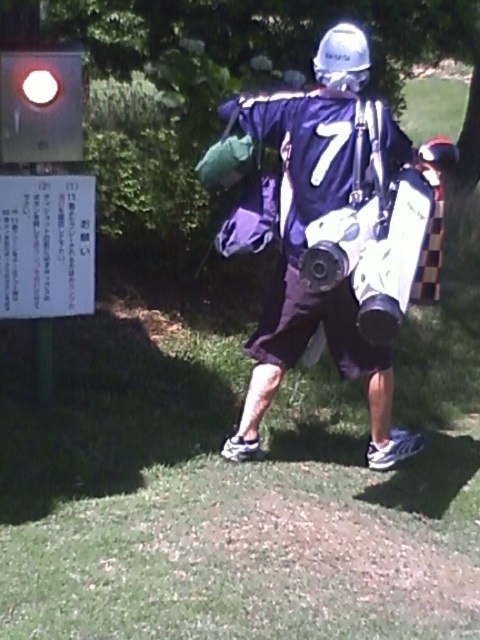
Between purple matte jersey at center and white paper sign at left, which one appears on the left side from the viewer's perspective?

white paper sign at left

Is the position of purple matte jersey at center less distant than that of white paper sign at left?

Yes, purple matte jersey at center is closer to the viewer.

Is point (319, 243) behind point (25, 177)?

That is False.

At what (x,y) coordinates should I click in order to perform the action: click on purple matte jersey at center. Please return your answer as a coordinate pair (x, y). The height and width of the screenshot is (640, 480). Looking at the image, I should click on (336, 236).

Is white paper sign at left taller than matte glass traffic light at upper left?

Yes.

Between point (12, 211) and point (11, 54), which one is positioned behind?

The point (12, 211) is behind.

Who is more forward, (24,280) or (7,60)?

Point (7,60)

Locate an element on the screen. The width and height of the screenshot is (480, 640). white paper sign at left is located at coordinates (47, 244).

Can you confirm if purple matte jersey at center is wider than matte glass traffic light at upper left?

Yes.

Who is more distant from viewer, (273, 100) or (20, 138)?

Point (273, 100)

Find the location of a particular element. This screenshot has height=640, width=480. purple matte jersey at center is located at coordinates (336, 236).